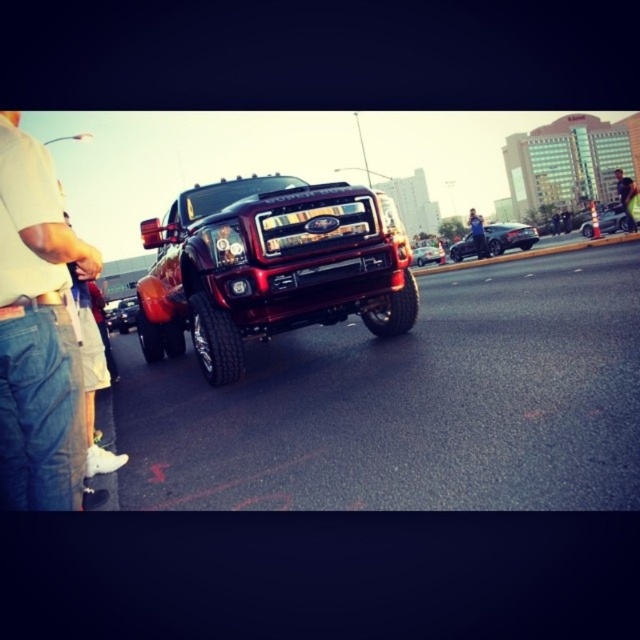
Question: Among these points, which one is nearest to the camera?

Choices:
 (A) (481, 237)
 (B) (413, 264)
 (C) (250, 314)

Answer: (C)

Question: Does glossy red truck at center have a larger size compared to glossy chrome car at center?

Choices:
 (A) no
 (B) yes

Answer: (A)

Question: Which is farther from the shiny chrome truck at center?

Choices:
 (A) jeans at left
 (B) shiny black car at center

Answer: (B)

Question: Can you confirm if metallic red truck at center is positioned to the left of smooth leather jacket at center?

Choices:
 (A) yes
 (B) no

Answer: (A)

Question: Can you confirm if shiny chrome truck at center is thinner than smooth leather jacket at center?

Choices:
 (A) yes
 (B) no

Answer: (A)

Question: Estimate the real-world distances between objects in this image. Which object is farther from the denim jacket at center?

Choices:
 (A) jeans at left
 (B) shiny black car at center
 (C) shiny chrome truck at center
 (D) smooth leather jacket at center

Answer: (A)